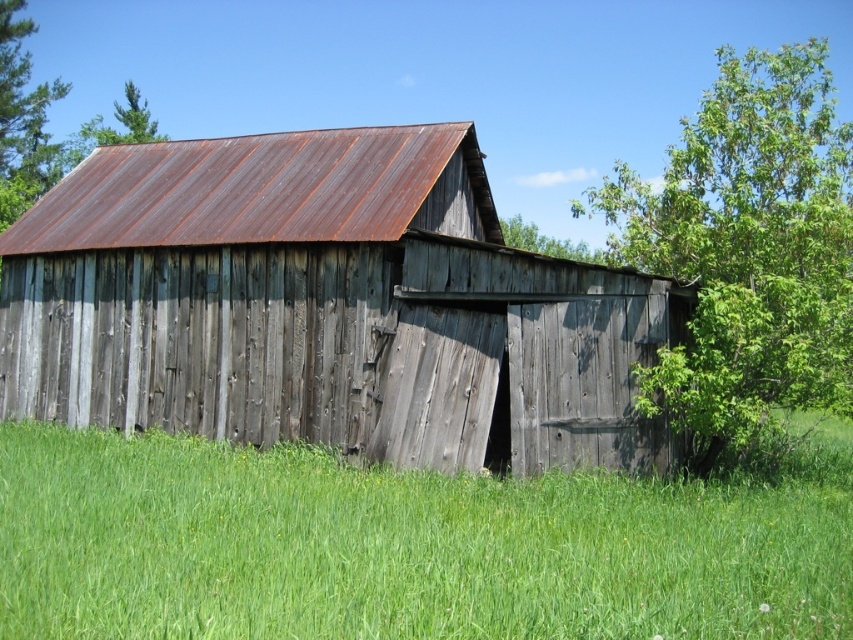
You are standing at the origin point of the image coordinate system. You want to walk to the rusty metal shed at center. In which direction should you go?

The rusty metal shed at center is located at point (x=323, y=307) in the 2D coordinate system. Since you are at the origin, you should move towards the positive x and positive y directions to reach it.

You are standing in the middle of the grassy field and want to take a photo of both the rusty metal shed at center and the green leafy tree at upper left. Which object should you zoom in on to ensure both are in the frame?

You should zoom in on the rusty metal shed at center because it is smaller than the green leafy tree at upper left, so adjusting focus on the smaller object will help both fit in the frame.

You are standing in the field looking at the old wooden barn. Which object is nearer to you, the green grass at lower center or the green leafy tree at upper right?

The green grass at lower center is closer to the viewer than the green leafy tree at upper right.